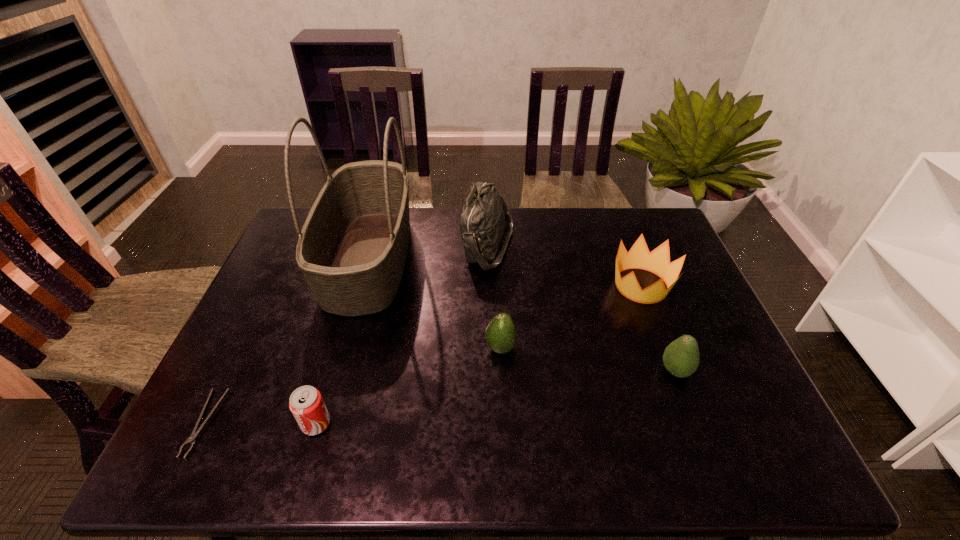
This screenshot has height=540, width=960. I want to click on basket, so click(352, 250).

At what (x,y) coordinates should I click in order to perform the action: click on the second tallest object. Please return your answer as a coordinate pair (x, y). The image size is (960, 540). Looking at the image, I should click on (485, 216).

I want to click on crown, so click(657, 261).

Identify the location of the right avocado. This screenshot has height=540, width=960. (681, 357).

At what (x,y) coordinates should I click in order to perform the action: click on the left avocado. Please return your answer as a coordinate pair (x, y). The image size is (960, 540). Looking at the image, I should click on (501, 335).

Find the location of a particular element. soda can is located at coordinates (306, 403).

Image resolution: width=960 pixels, height=540 pixels. Identify the location of the leftmost object. point(192,439).

Where is `tongs`? tongs is located at coordinates (192, 439).

Identify the location of blank space located on the front of the tallest object. (320, 430).

Identify the location of free space located at the front padded panel of the shoulder bag. (425, 246).